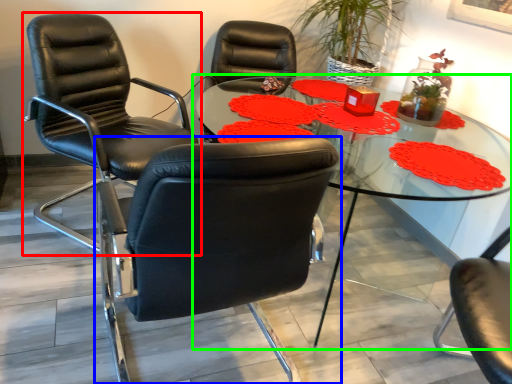
Question: Estimate the real-world distances between objects in this image. Which object is closer to chair (highlighted by a red box), chair (highlighted by a blue box) or table (highlighted by a green box)?

Choices:
 (A) chair
 (B) table

Answer: (B)